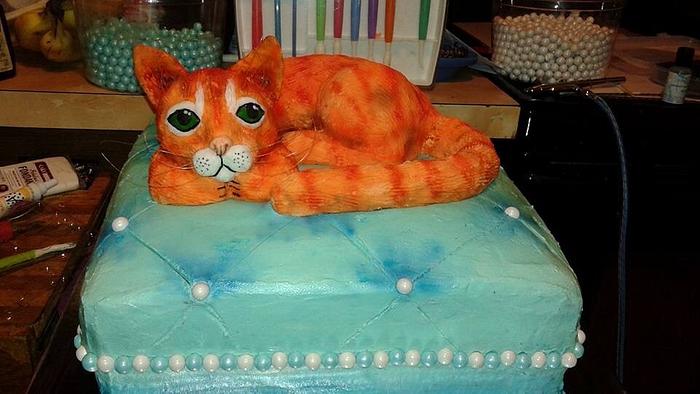
You are a GUI agent. You are given a task and a screenshot of the screen. Output one action in this format:
    pyautogui.click(x=<x>, y=<y>)
    Task: Click on the bowl
    The height and width of the screenshot is (394, 700).
    Given the screenshot: What is the action you would take?
    pyautogui.click(x=575, y=60)